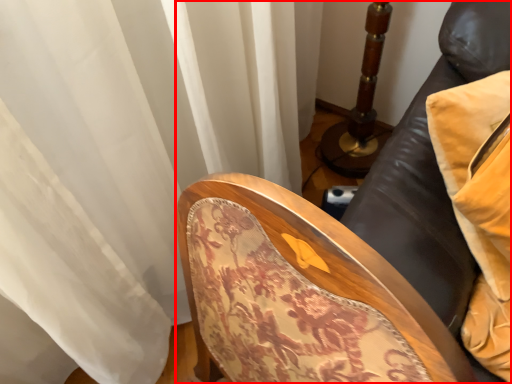
Question: From the image's perspective, where is furniture (annotated by the red box) located relative to pillow?

Choices:
 (A) below
 (B) above

Answer: (A)